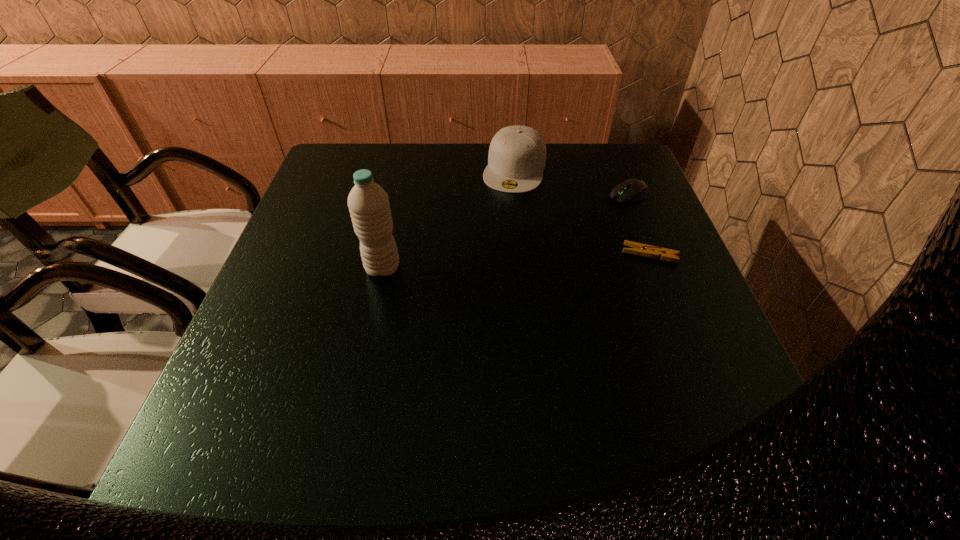
Find the location of a particular element. the leftmost object is located at coordinates (368, 203).

Find the location of a particular element. Image resolution: width=960 pixels, height=540 pixels. the tallest object is located at coordinates (368, 203).

Find the location of a particular element. The image size is (960, 540). clothespin is located at coordinates (639, 249).

This screenshot has width=960, height=540. In order to click on cap in this screenshot , I will do tap(517, 154).

At what (x,y) coordinates should I click in order to perform the action: click on the third object from right to left. Please return your answer as a coordinate pair (x, y). This screenshot has height=540, width=960. Looking at the image, I should click on (517, 154).

I want to click on computer mouse, so click(631, 190).

Where is `free space located on the back of the water bottle`? free space located on the back of the water bottle is located at coordinates (398, 194).

At what (x,y) coordinates should I click in order to perform the action: click on vacant space located on the front of the shortest object. Please return your answer as a coordinate pair (x, y). The height and width of the screenshot is (540, 960). Looking at the image, I should click on (696, 372).

At what (x,y) coordinates should I click in order to perform the action: click on free space located 0.210m on the front-facing side of the second object from left to right. Please return your answer as a coordinate pair (x, y). The height and width of the screenshot is (540, 960). Looking at the image, I should click on (493, 244).

In order to click on vacant space located on the front-facing side of the second object from left to right in this screenshot , I will do `click(496, 233)`.